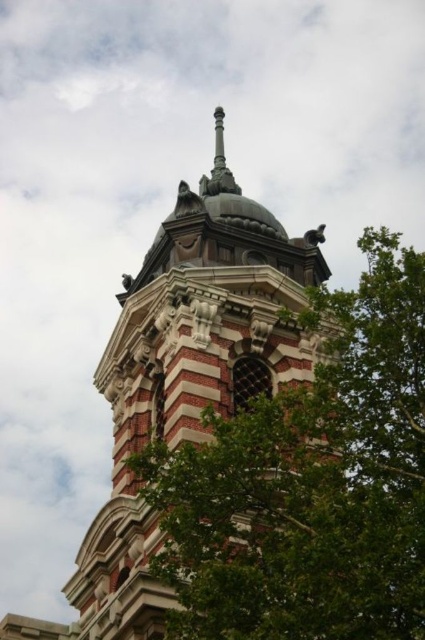
Between point (223, 397) and point (226, 177), which one is positioned in front?

Point (223, 397) is more forward.

The image size is (425, 640). Find the location of `polished stone tower at center`. polished stone tower at center is located at coordinates (183, 384).

Which is in front, point (407, 273) or point (255, 381)?

Point (407, 273) is more forward.

Who is taller, green leafy tree at center or polished stone tower at center?

polished stone tower at center

The height and width of the screenshot is (640, 425). I want to click on green leafy tree at center, so click(x=309, y=481).

Who is more distant from viewer, (209, 449) or (221, 168)?

Positioned behind is point (221, 168).

Which is below, green leafy tree at center or polished brass spire at center top?

Positioned lower is green leafy tree at center.

This screenshot has height=640, width=425. What do you see at coordinates (309, 481) in the screenshot?
I see `green leafy tree at center` at bounding box center [309, 481].

Locate an element on the screen. The width and height of the screenshot is (425, 640). green leafy tree at center is located at coordinates (309, 481).